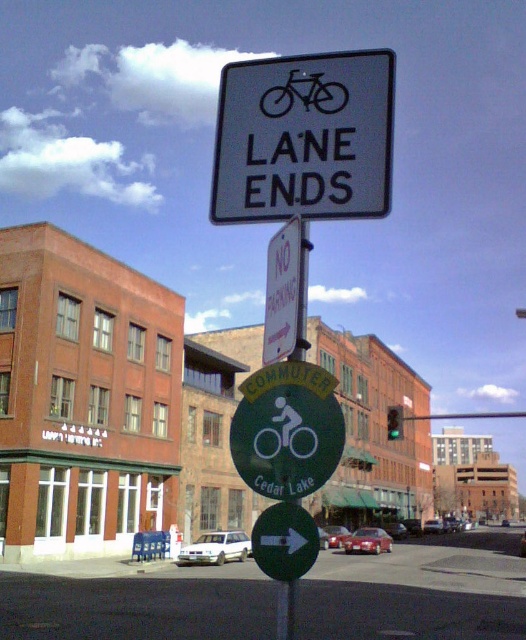
Who is more forward, (8, 573) or (322, 77)?

Positioned in front is point (322, 77).

Who is higher up, green matte sign at center or black rubber bicycle at upper center?

Positioned higher is black rubber bicycle at upper center.

Describe the element at coordinates (135, 608) in the screenshot. The image size is (526, 640). I see `green matte sign at center` at that location.

What are the coordinates of `green matte sign at center` in the screenshot? It's located at (135, 608).

Can you confirm if white plastic sign at upper center is wider than green matte sign at center?

No, white plastic sign at upper center is not wider than green matte sign at center.

Who is positioned more to the left, white plastic sign at upper center or green matte sign at center?

green matte sign at center is more to the left.

This screenshot has width=526, height=640. Describe the element at coordinates (305, 138) in the screenshot. I see `white plastic sign at upper center` at that location.

Identify the location of white plastic sign at upper center. The image size is (526, 640). (305, 138).

Which of these two, white plastic sign at upper center or black rubber bicycle at upper center, stands taller?

Standing taller between the two is white plastic sign at upper center.

Describe the element at coordinates (305, 138) in the screenshot. The height and width of the screenshot is (640, 526). I see `white plastic sign at upper center` at that location.

Which is in front, point (271, 161) or point (320, 109)?

Positioned in front is point (271, 161).

Where is `white plastic sign at upper center`? The width and height of the screenshot is (526, 640). white plastic sign at upper center is located at coordinates (305, 138).